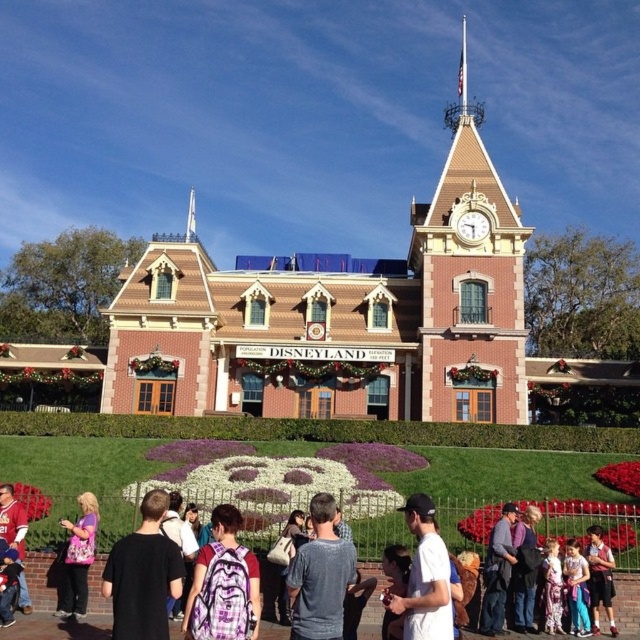
Question: Does gray cotton shirt at center appear on the right side of matte purple shirt at lower left?

Choices:
 (A) no
 (B) yes

Answer: (B)

Question: Which point appears closest to the camera in this image?

Choices:
 (A) (483, 218)
 (B) (605, 515)
 (C) (141, 596)

Answer: (C)

Question: Which object is positioned farthest from the matte brown clock tower at upper center?

Choices:
 (A) gold metallic clock at upper center
 (B) matte purple shirt at lower left
 (C) brown textured building at center
 (D) black t-shirt at lower left

Answer: (D)

Question: Which object is positioned farthest from the gold metallic clock at upper center?

Choices:
 (A) matte brown clock tower at upper center
 (B) dark blue jeans at lower right
 (C) gray cotton shirt at center

Answer: (C)

Question: Can you confirm if matte brown clock tower at upper center is positioned to the left of gold metallic clock at upper center?

Choices:
 (A) yes
 (B) no

Answer: (B)

Question: Does white matte shirt at lower center appear under matte purple shirt at lower left?

Choices:
 (A) yes
 (B) no

Answer: (B)